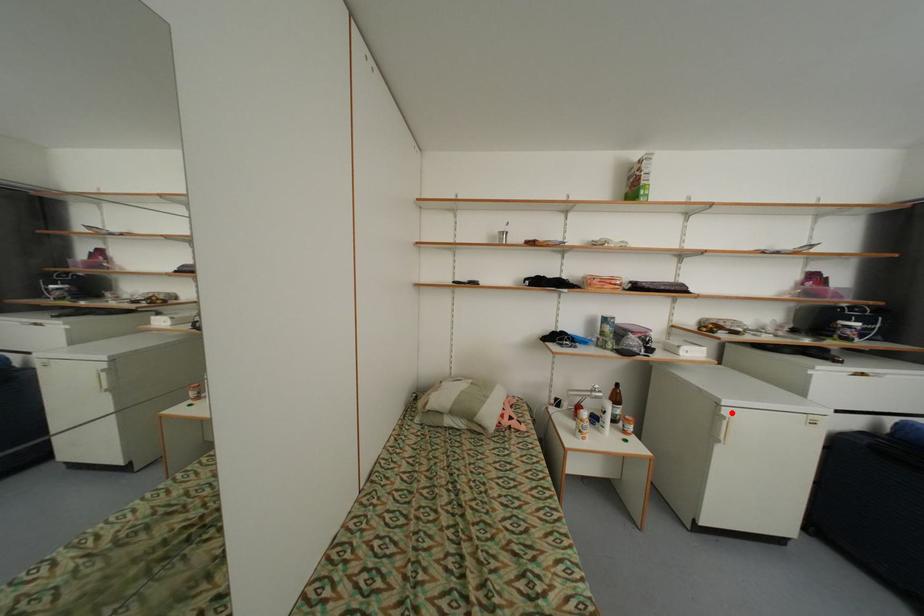
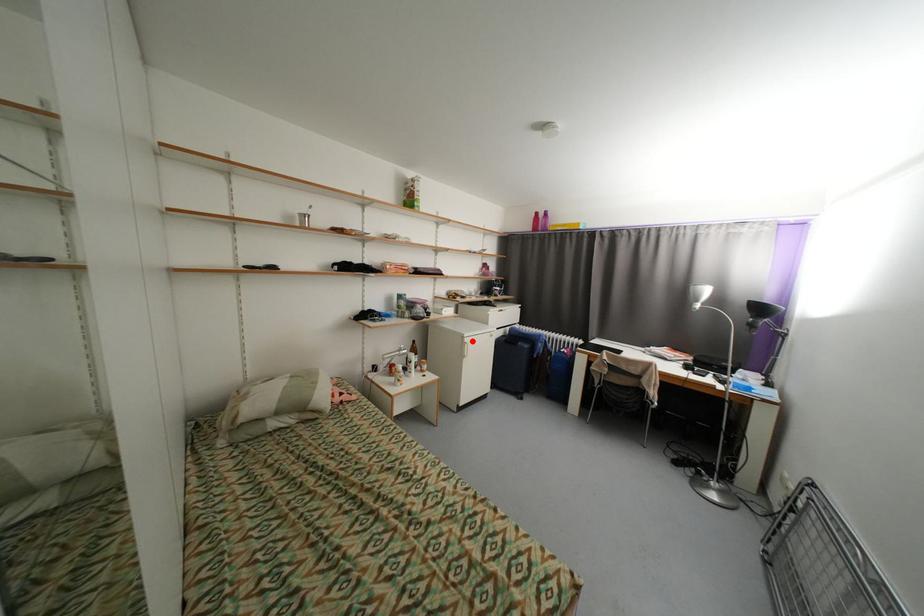
I am providing you with two images of the same scene from different viewpoints. A red point is marked on the first image and another point is marked on the second image. Do the highlighted points in image1 and image2 indicate the same real-world spot?

Yes